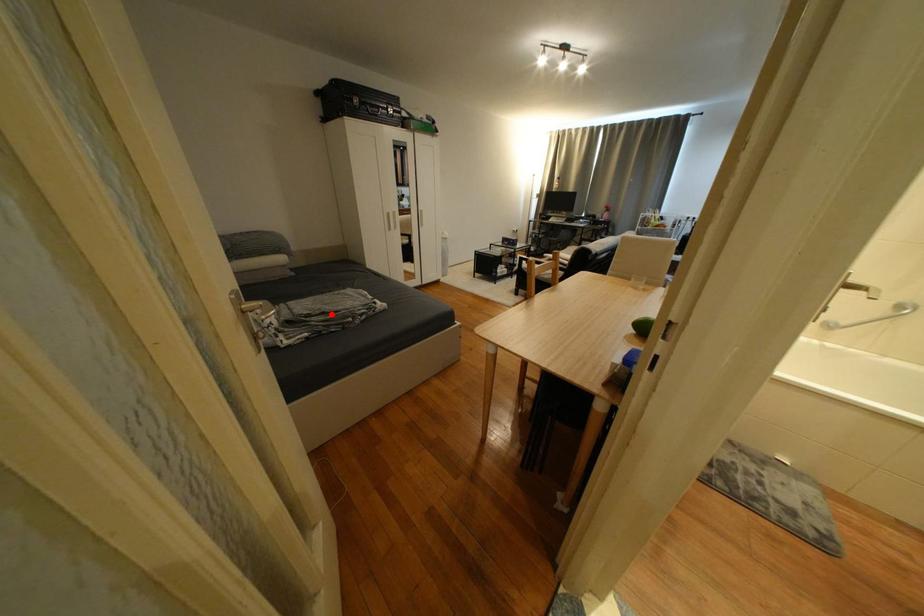
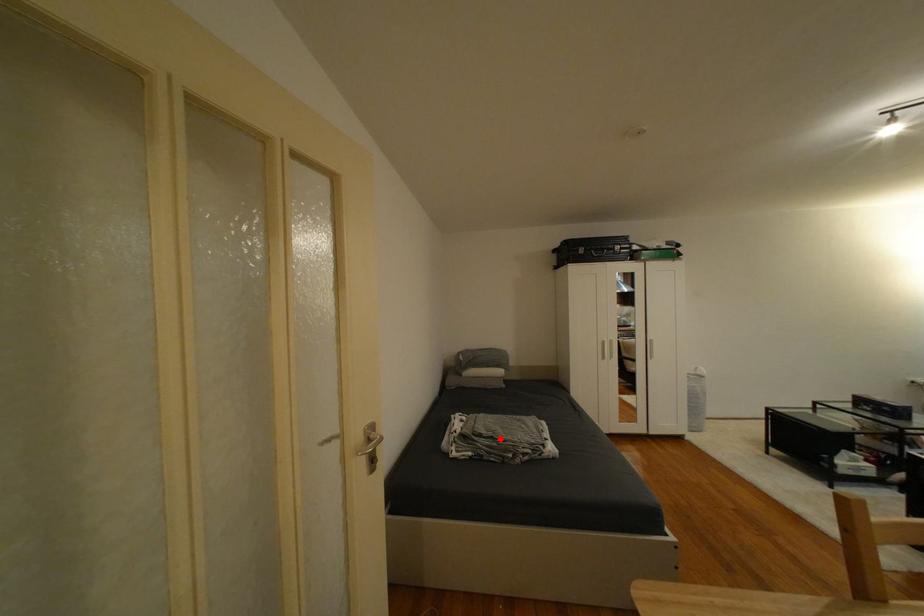
I am providing you with two images of the same scene from different viewpoints. A red point is marked on the first image and another point is marked on the second image. Is the red point in image1 aligned with the point shown in image2?

Yes